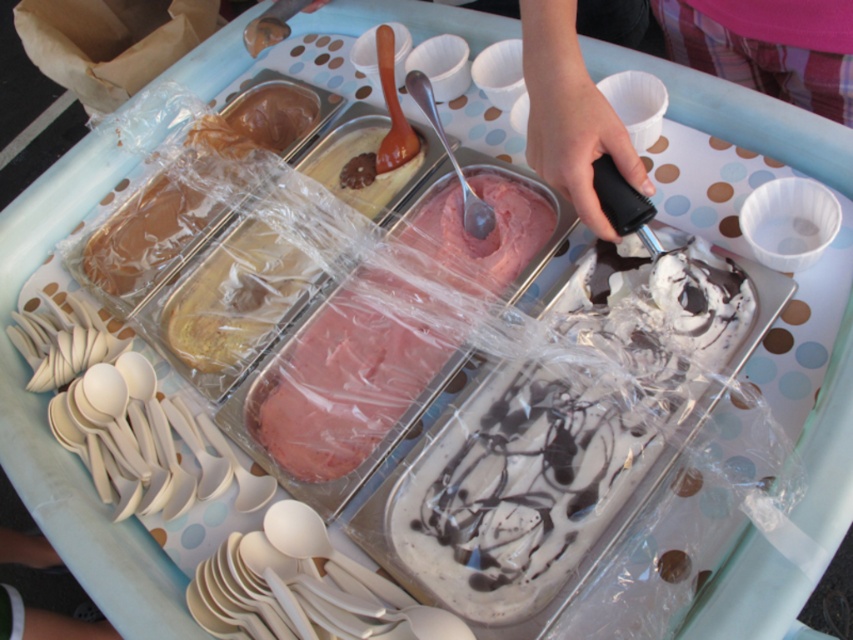
You are at an ice cream station and want to choose between the pink creamy ice cream at center and the smooth black ice cream scoop at center. Which one has a greater width?

The pink creamy ice cream at center has a greater width than the smooth black ice cream scoop at center.

Based on the coordinates provided, where exactly is the pink creamy ice cream at center located in the image?

The pink creamy ice cream at center is located at coordinates point (345, 387).